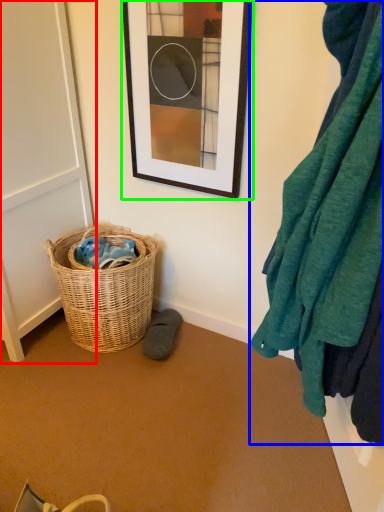
Question: Based on their relative distances, which object is nearer to screen door (highlighted by a red box)? Choose from blanket (highlighted by a blue box) and picture frame (highlighted by a green box).

Choices:
 (A) blanket
 (B) picture frame

Answer: (B)